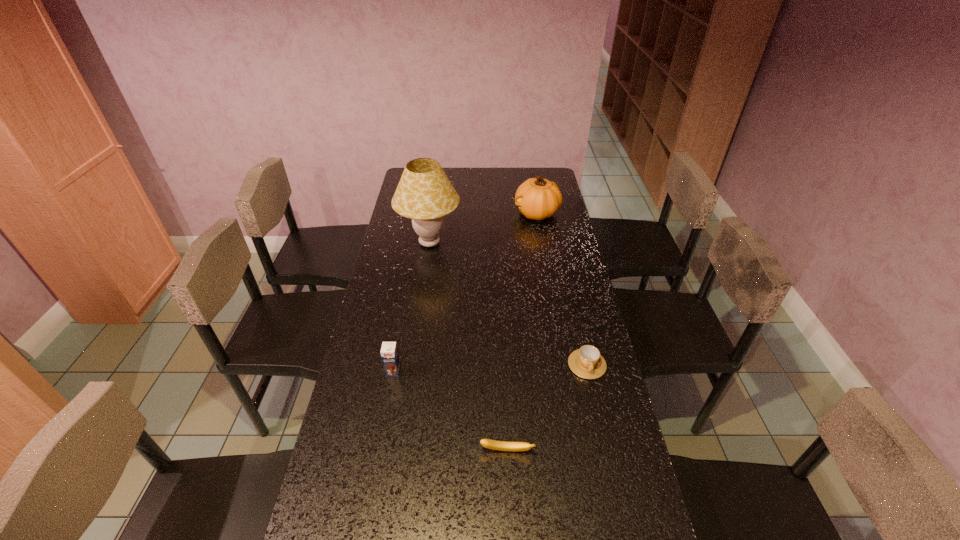
Image resolution: width=960 pixels, height=540 pixels. In order to click on free space at the far right corner of the desktop in this screenshot , I will do `click(547, 173)`.

What are the coordinates of `vacant space that's between the cup and the tallest object` in the screenshot? It's located at (508, 303).

Locate an element on the screen. The height and width of the screenshot is (540, 960). free space between the third tallest object and the tallest object is located at coordinates (412, 307).

You are a GUI agent. You are given a task and a screenshot of the screen. Output one action in this format:
    pyautogui.click(x=<x>, y=<y>)
    Task: Click on the vacant area between the fourth shortest object and the cup
    Image resolution: width=960 pixels, height=540 pixels.
    Given the screenshot: What is the action you would take?
    pyautogui.click(x=562, y=289)

Locate an element on the screen. This screenshot has height=540, width=960. blank region between the chocolate milk and the nearest object is located at coordinates (450, 411).

The height and width of the screenshot is (540, 960). What are the coordinates of `empty location between the tallest object and the third object from left to right` in the screenshot? It's located at (468, 347).

Locate an element on the screen. The height and width of the screenshot is (540, 960). vacant area that lies between the pumpkin and the third object from left to right is located at coordinates pyautogui.click(x=522, y=332).

This screenshot has height=540, width=960. What are the coordinates of `empty location between the cup and the third tallest object` in the screenshot? It's located at (491, 368).

At what (x,y) coordinates should I click in order to perform the action: click on vacant region between the chocolate milk and the cup. Please return your answer as a coordinate pair (x, y). This screenshot has height=540, width=960. Looking at the image, I should click on (491, 368).

Locate an element on the screen. free space between the cup and the third object from right to left is located at coordinates (547, 407).